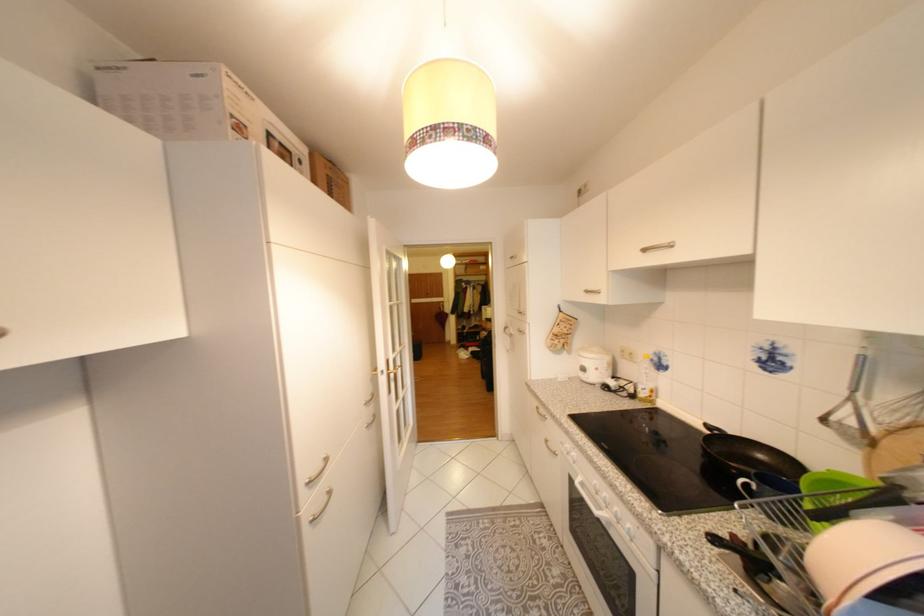
Describe the element at coordinates (590, 500) in the screenshot. The width and height of the screenshot is (924, 616). I see `the white oven handle` at that location.